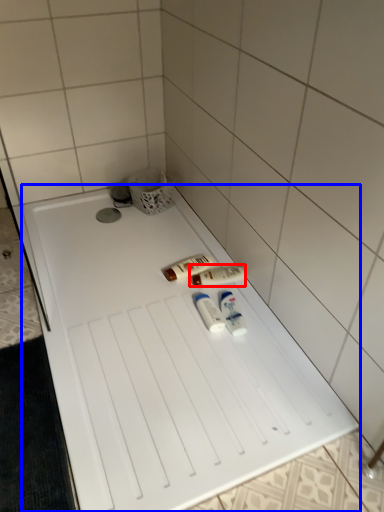
Question: Among these objects, which one is nearest to the camera, toiletry (highlighted by a red box) or furniture (highlighted by a blue box)?

Choices:
 (A) toiletry
 (B) furniture

Answer: (B)